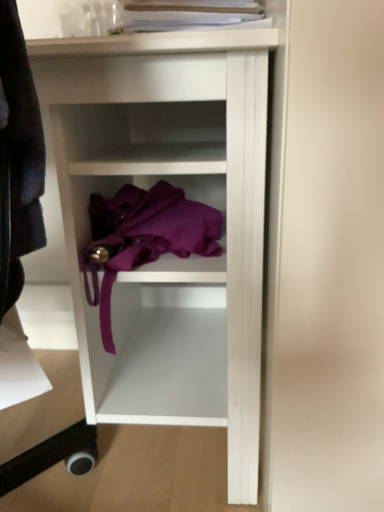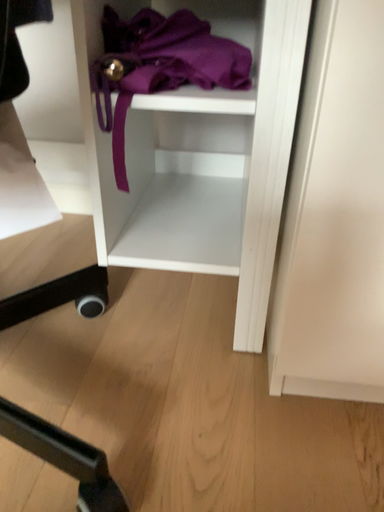
Question: How did the camera likely rotate when shooting the video?

Choices:
 (A) rotated downward
 (B) rotated upward

Answer: (A)